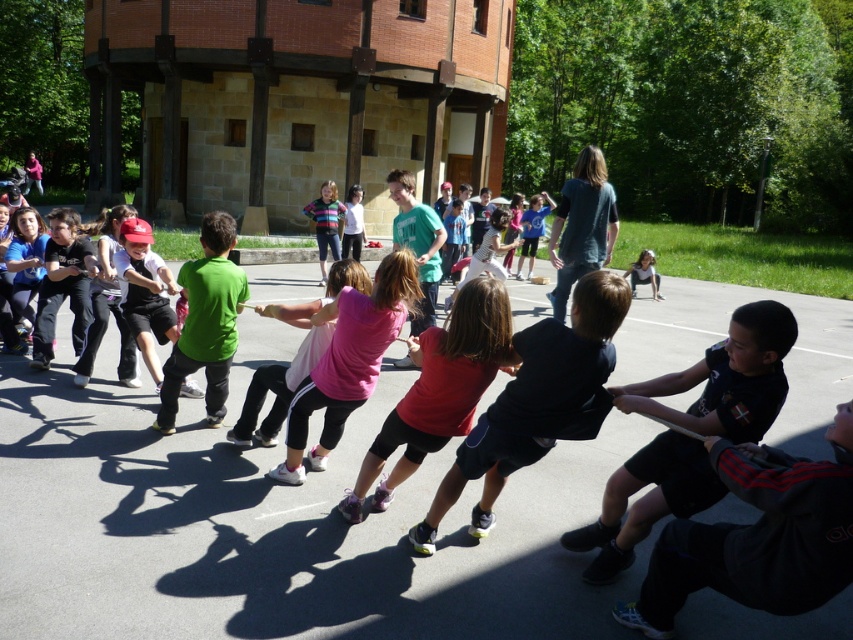
You are a photographer standing at the edge of the smooth asphalt basketball court at center. You want to take a photo of the court while ensuring that the entire court fits in the frame. If your camera has a maximum focal length of 50mm and you are using a full frame sensor, what is the minimum distance you need to be from the court to capture it entirely?

The smooth asphalt basketball court at center is 12.65 feet from camera. To capture the entire court in the frame with a 50mm lens on a full frame sensor, you need to be at least 12.65 feet away from the court.

You are a parent trying to retrieve your child wearing a green jersey at center from the smooth asphalt basketball court at center. The safest path to reach them requires moving around the perimeter of the court. If the court has a rectangular shape and the shortest distance between you and the child is 3.39 meters, what is the minimum length of the path you must take to reach them?

The minimum length of the path you must take to reach the green jersey at center from the smooth asphalt basketball court at center is 3.39 meters, which is the straight line distance between them. However, since you must move around the perimeter of the court, the actual path will be longer than this distance.

You are standing at the entrance of the brick building in the background. Looking towards the smooth asphalt basketball court at center, what are the coordinates of the basketball court in the image?

The coordinates of the smooth asphalt basketball court at center are at point (271, 522).